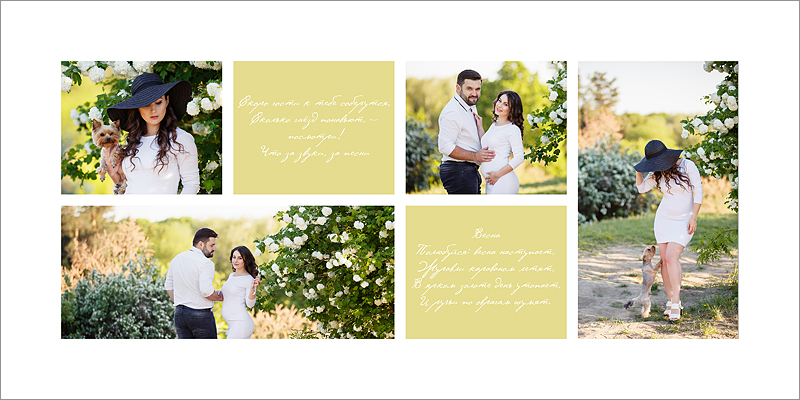
In order to click on family photos in this screenshot , I will do `click(126, 119)`, `click(488, 113)`, `click(689, 180)`, `click(209, 294)`.